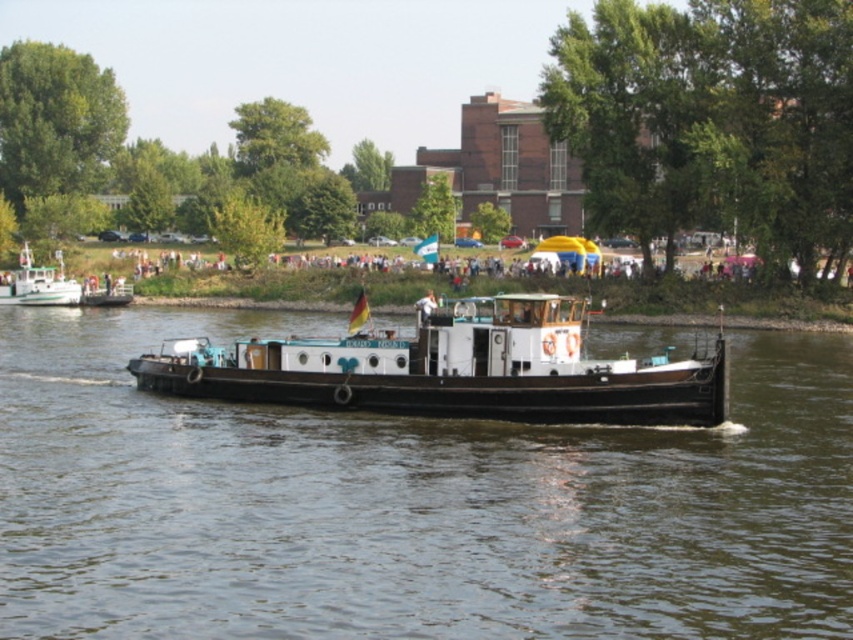
You are a dock worker who needs to load a cargo container onto the black matte barge at center and the green matte boat at left. Based on their widths, which vessel can accommodate the container if the container requires a minimum width of 10 meters?

The black matte barge at center might be wider than green matte boat at left, so it is possible that the black matte barge at center can accommodate the container if its width meets or exceeds 10 meters. The green matte boat at left may be narrower and might not meet the required width.

You are a photographer positioned on the riverside. You want to capture both the wooden boat at center and the green matte boat at left in a single shot. Which boat will appear larger in your photo?

The wooden boat at center will appear larger in the photo because it is closer to the viewer than the green matte boat at left.

You are a photographer planning to capture both the wooden boat at center and the green matte boat at left in a single frame. Based on their sizes, which boat should you focus on to ensure both fit in the photo without cropping?

Since the wooden boat at center is shorter than the green matte boat at left, you should focus on the green matte boat at left as it is larger and will require more space in the frame, ensuring both boats can be captured without cropping.